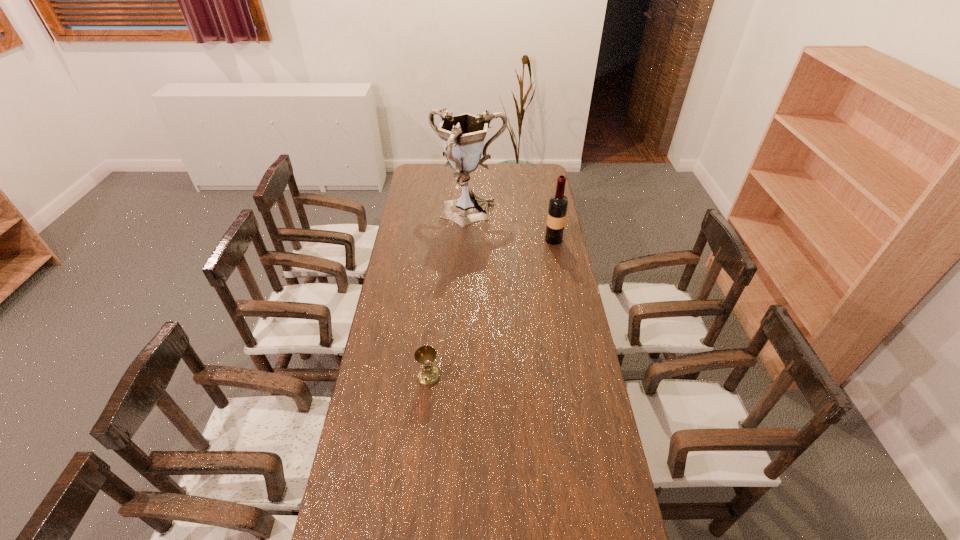
This screenshot has width=960, height=540. In order to click on trophy cup in this screenshot , I will do `click(463, 135)`.

The height and width of the screenshot is (540, 960). I want to click on the second tallest object, so click(x=558, y=203).

Image resolution: width=960 pixels, height=540 pixels. I want to click on wine bottle, so click(x=558, y=203).

The image size is (960, 540). I want to click on the nearest object, so click(x=428, y=374).

Locate an element on the screen. the shortest object is located at coordinates (428, 374).

The height and width of the screenshot is (540, 960). Find the location of `vacant region located 0.140m on the left of the trophy cup`. vacant region located 0.140m on the left of the trophy cup is located at coordinates (404, 214).

At what (x,y) coordinates should I click in order to perform the action: click on vacant space situated 0.270m on the front of the rightmost object. Please return your answer as a coordinate pair (x, y). Looking at the image, I should click on click(563, 286).

Identify the location of free region located on the front of the shortest object. 424,416.

Identify the location of object located at the left edge. (463, 135).

The image size is (960, 540). In order to click on object situated at the right edge in this screenshot , I will do `click(558, 203)`.